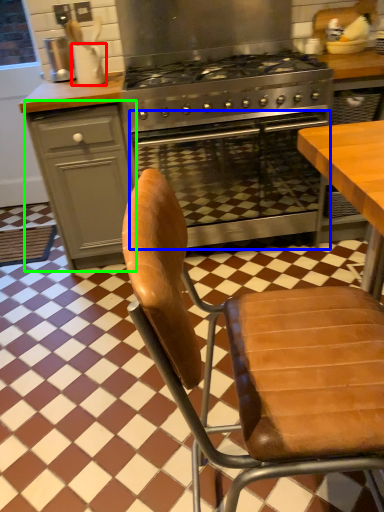
Question: Considering the real-world distances, which object is closest to kitchen appliance (highlighted by a red box)? oven (highlighted by a blue box) or cabinetry (highlighted by a green box).

Choices:
 (A) oven
 (B) cabinetry

Answer: (B)